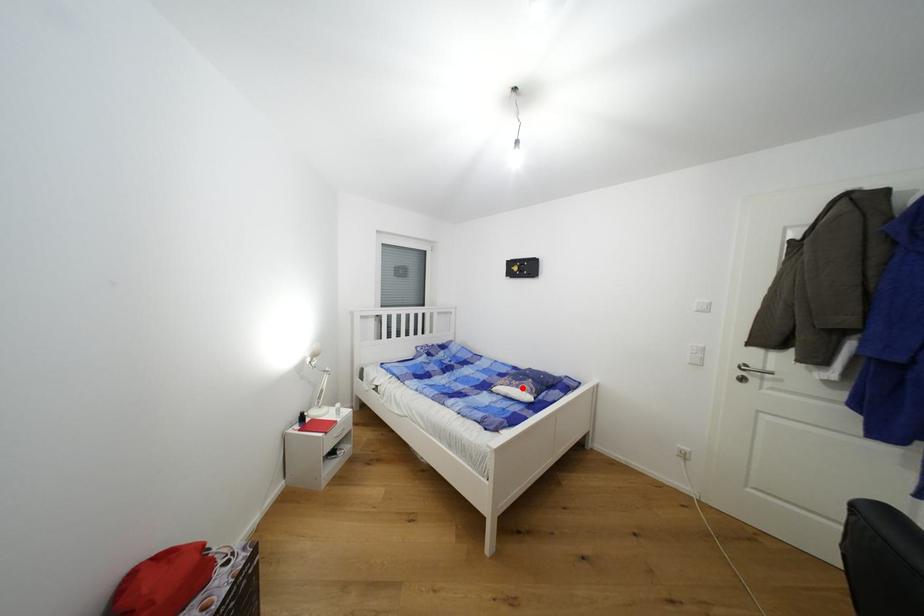
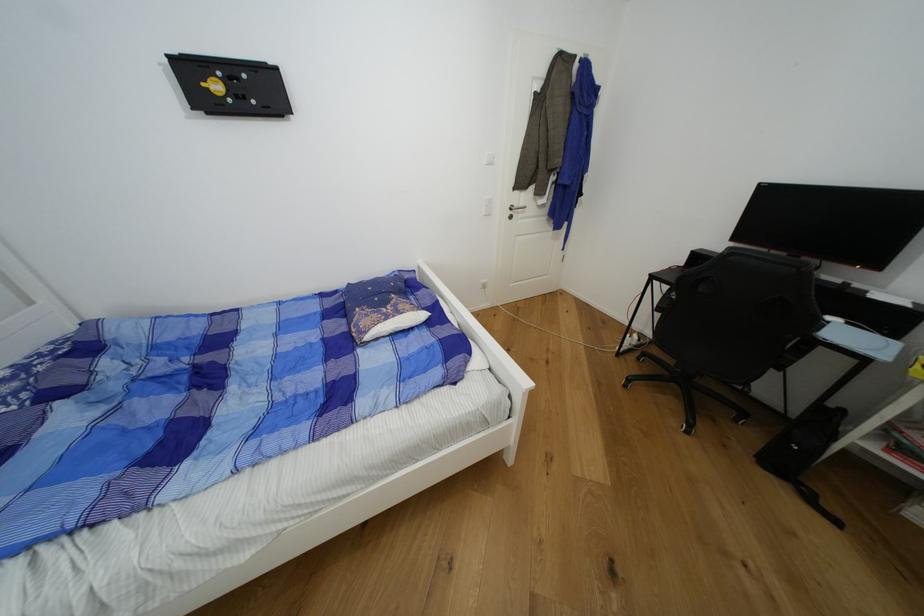
Question: I am providing you with two images of the same scene from different viewpoints. A red point is shown in image1. For the corresponding object point in image2, is it positioned nearer or farther from the camera?

Choices:
 (A) Nearer
 (B) Farther

Answer: (B)